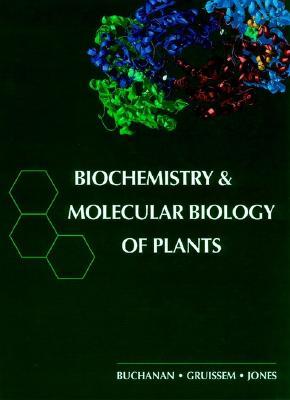
I want to click on dark blue and black abstract artwork, so click(170, 29).